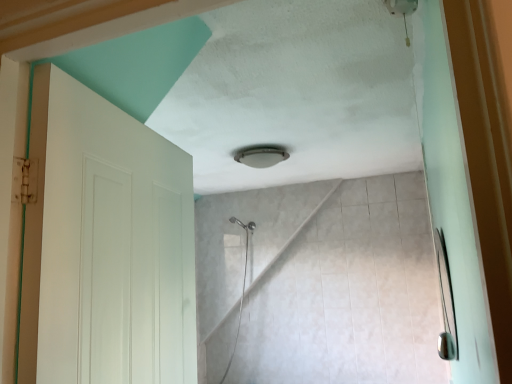
Question: Should I look upward or downward to see white matte door at left?

Choices:
 (A) down
 (B) up

Answer: (A)